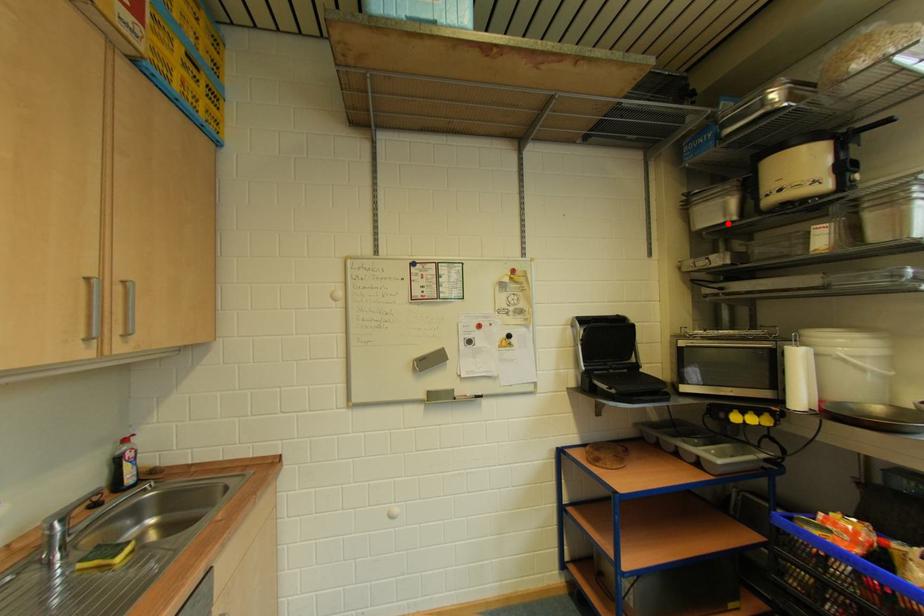
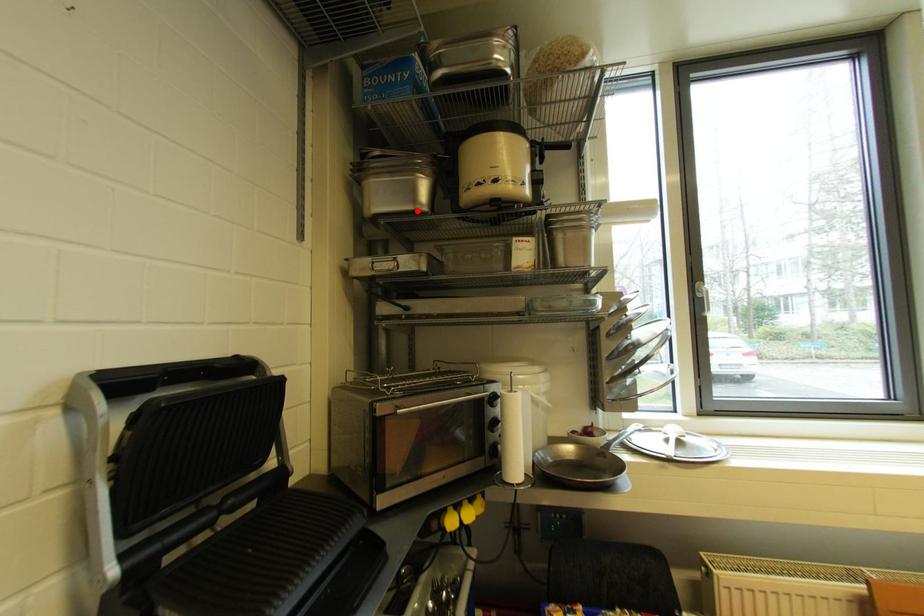
I am providing you with two images of the same scene from different viewpoints. A red point is marked on the first image and another point is marked on the second image. Do the highlighted points in image1 and image2 indicate the same real-world spot?

Yes